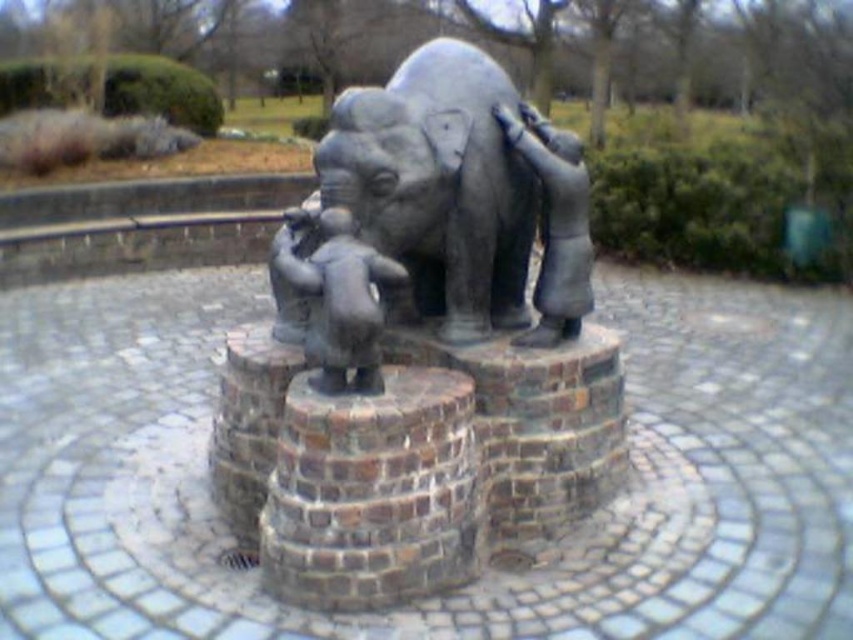
Question: Does bronze statue of elephant at center have a lesser width compared to brown brick stump at center?

Choices:
 (A) yes
 (B) no

Answer: (B)

Question: Based on their relative distances, which object is nearer to the brown brick stump at center?

Choices:
 (A) matte gray statue at center
 (B) polished bronze statue at center
 (C) bronze statue of elephant at center

Answer: (A)

Question: Does matte gray statue at center appear on the right side of polished bronze statue at center?

Choices:
 (A) yes
 (B) no

Answer: (B)

Question: Which point is farther from the camera taking this photo?

Choices:
 (A) (376, 595)
 (B) (436, 48)

Answer: (B)

Question: Which object is farther from the camera taking this photo?

Choices:
 (A) matte gray statue at center
 (B) polished bronze statue at center
 (C) bronze statue of elephant at center

Answer: (B)

Question: Can you confirm if bronze statue of elephant at center is bigger than polished bronze statue at center?

Choices:
 (A) yes
 (B) no

Answer: (A)